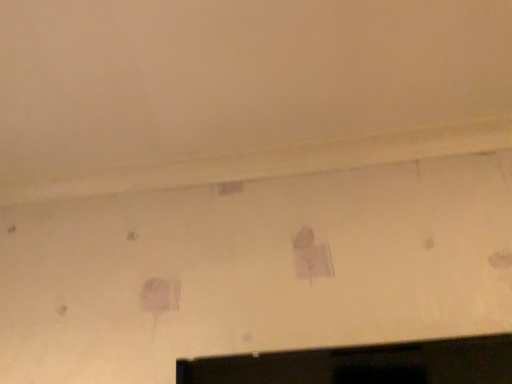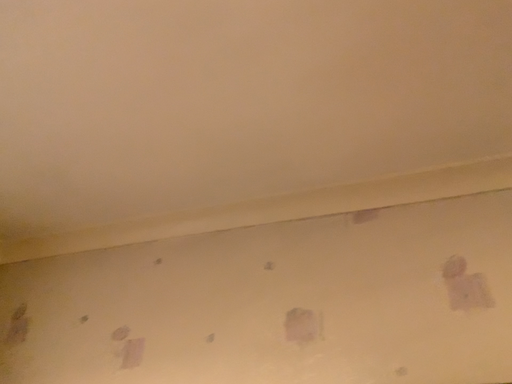
Question: Which way did the camera rotate in the video?

Choices:
 (A) rotated right
 (B) rotated left

Answer: (B)